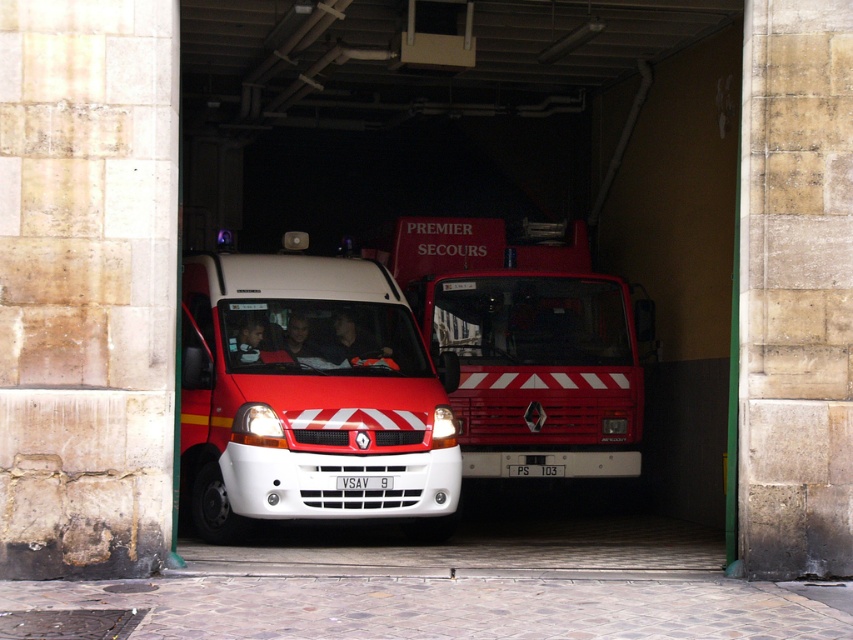
Question: Which point is farther to the camera?

Choices:
 (A) white matte van at center
 (B) red matte fire truck at center

Answer: (B)

Question: Which object is closer to the camera taking this photo?

Choices:
 (A) red matte fire truck at center
 (B) white matte van at center

Answer: (B)

Question: Is white matte van at center to the left of red matte fire truck at center from the viewer's perspective?

Choices:
 (A) yes
 (B) no

Answer: (A)

Question: Does white matte van at center have a smaller size compared to red matte fire truck at center?

Choices:
 (A) no
 (B) yes

Answer: (A)

Question: Is white matte van at center to the left of red matte fire truck at center from the viewer's perspective?

Choices:
 (A) yes
 (B) no

Answer: (A)